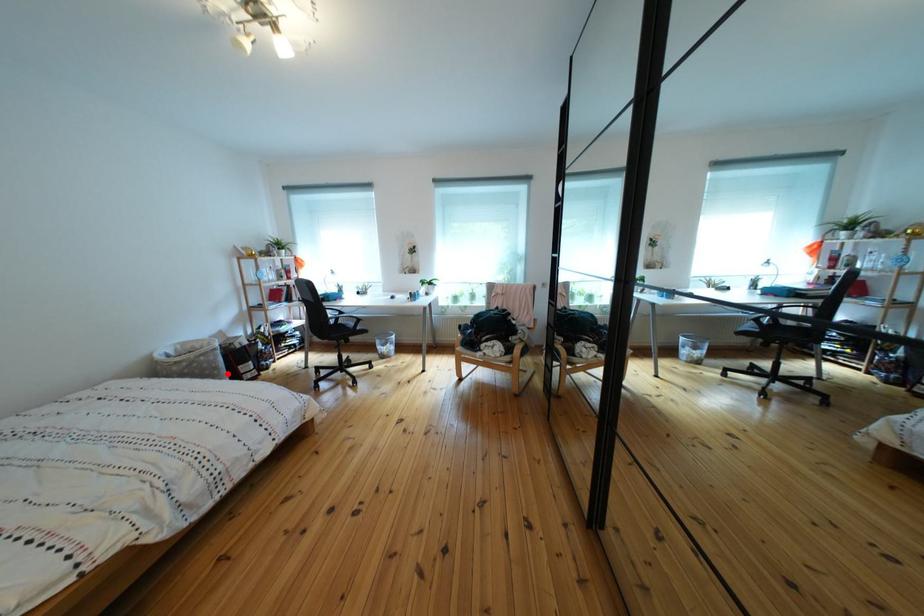
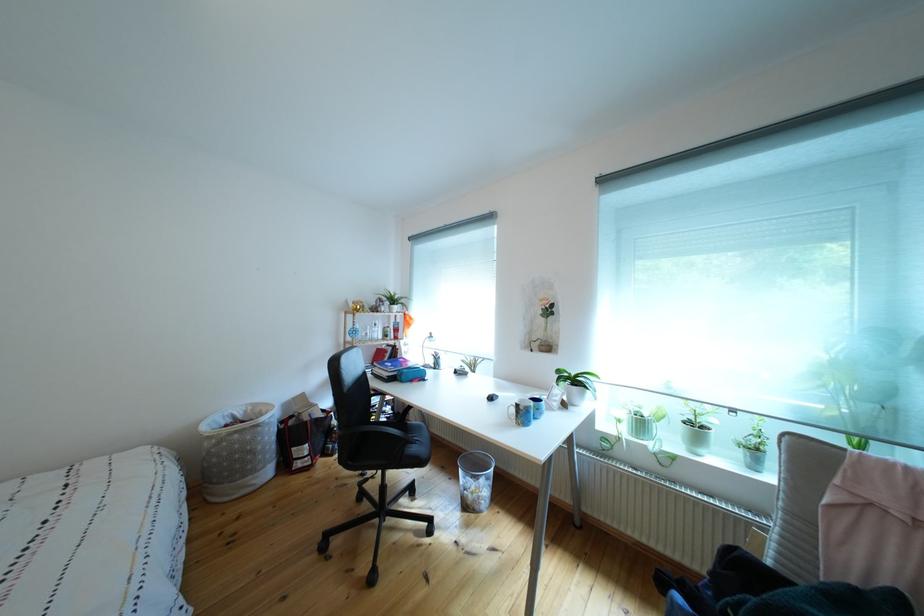
Question: I am providing you with two images of the same scene from different viewpoints. Image1 has a red point marked. In image2, the corresponding 3D location appears at what relative position? Reply with the corresponding letter.

Choices:
 (A) Closer
 (B) Farther

Answer: (B)